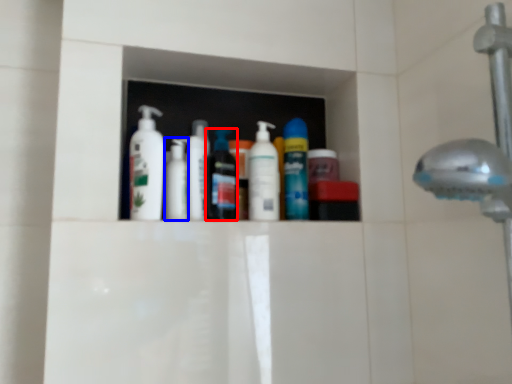
Question: Which of the following is the closest to the observer, mouthwash (highlighted by a red box) or toiletry (highlighted by a blue box)?

Choices:
 (A) mouthwash
 (B) toiletry

Answer: (A)